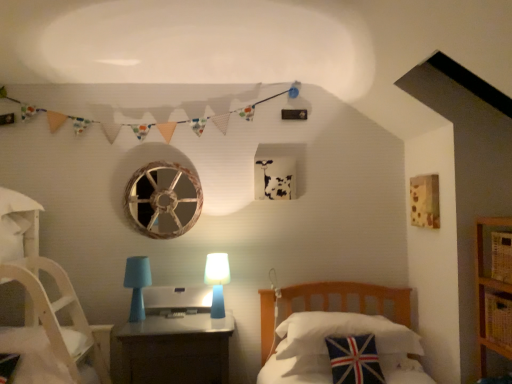
The height and width of the screenshot is (384, 512). I want to click on rustic wood wheel at center, so click(163, 200).

This screenshot has height=384, width=512. What do you see at coordinates (163, 200) in the screenshot?
I see `rustic wood wheel at center` at bounding box center [163, 200].

Locate an element on the screen. The height and width of the screenshot is (384, 512). satin silver desktop at center is located at coordinates (177, 299).

At what (x,y) coordinates should I click in order to perform the action: click on yellow woven basket at lower right. Please return your answer as a coordinate pair (x, y). The image size is (512, 384). Looking at the image, I should click on (498, 317).

Does light blue plastic table lamp at center, the 2th table lamp viewed from the right, have a lesser height compared to matte plastic nightstand at center?

Correct, light blue plastic table lamp at center, the 2th table lamp viewed from the right, is not as tall as matte plastic nightstand at center.

The width and height of the screenshot is (512, 384). I want to click on nightstand below the light blue plastic table lamp at center, the 2th table lamp viewed from the right (from the image's perspective), so point(174,350).

Considering the relative positions of light blue plastic table lamp at center, the 2th table lamp viewed from the right, and matte plastic nightstand at center in the image provided, is light blue plastic table lamp at center, the 2th table lamp viewed from the right, to the left of matte plastic nightstand at center from the viewer's perspective?

Indeed, light blue plastic table lamp at center, the 2th table lamp viewed from the right, is positioned on the left side of matte plastic nightstand at center.

Does point (190, 219) come farther from viewer compared to point (219, 268)?

Yes, it is.

From the picture: Considering the relative sizes of rustic wood wheel at center and blue matte table lamp at center, positioned as the 1th table lamp in right-to-left order, in the image provided, is rustic wood wheel at center taller than blue matte table lamp at center, positioned as the 1th table lamp in right-to-left order,?

Correct, rustic wood wheel at center is much taller as blue matte table lamp at center, positioned as the 1th table lamp in right-to-left order.

Is rustic wood wheel at center positioned behind blue matte table lamp at center, positioned as the 1th table lamp in right-to-left order?

Yes, rustic wood wheel at center is further from the viewer.

Considering the relative sizes of rustic wood wheel at center and blue matte table lamp at center, which appears as the second table lamp when viewed from the left, in the image provided, is rustic wood wheel at center wider than blue matte table lamp at center, which appears as the second table lamp when viewed from the left,?

No.

Looking at this image, which is closer, (311, 326) or (216, 291)?

Point (311, 326) appears to be closer to the viewer than point (216, 291).

Is union jack fabric pillow at center, which appears as the 1th pillow when viewed from the back, looking in the opposite direction of blue matte table lamp at center, positioned as the 1th table lamp in right-to-left order?

No, blue matte table lamp at center, positioned as the 1th table lamp in right-to-left order, is not at the back of union jack fabric pillow at center, which appears as the 1th pillow when viewed from the back.

Considering the relative positions of union jack fabric pillow at center, which appears as the 1th pillow when viewed from the back, and blue matte table lamp at center, positioned as the 1th table lamp in right-to-left order, in the image provided, is union jack fabric pillow at center, which appears as the 1th pillow when viewed from the back, to the left or to the right of blue matte table lamp at center, positioned as the 1th table lamp in right-to-left order,?

union jack fabric pillow at center, which appears as the 1th pillow when viewed from the back, is positioned on blue matte table lamp at center, positioned as the 1th table lamp in right-to-left order,'s right side.

What's the angular difference between union jack fabric pillow at center, which appears as the 1th pillow when viewed from the back, and blue matte table lamp at center, which appears as the second table lamp when viewed from the left,'s facing directions?

2.11 degrees separate the facing orientations of union jack fabric pillow at center, which appears as the 1th pillow when viewed from the back, and blue matte table lamp at center, which appears as the second table lamp when viewed from the left.

Is union jack fabric pillow at lower right, which is the second pillow from back to front, in front of or behind matte plastic nightstand at center in the image?

union jack fabric pillow at lower right, which is the second pillow from back to front, is in front of matte plastic nightstand at center.

Considering the relative positions of union jack fabric pillow at lower right, which appears as the first pillow when viewed from the front, and matte plastic nightstand at center in the image provided, is union jack fabric pillow at lower right, which appears as the first pillow when viewed from the front, to the left of matte plastic nightstand at center from the viewer's perspective?

No.

Is union jack fabric pillow at lower right, which is the second pillow from back to front, bigger than matte plastic nightstand at center?

No, union jack fabric pillow at lower right, which is the second pillow from back to front, is not bigger than matte plastic nightstand at center.

From the image's perspective, is union jack fabric pillow at lower right, which is the second pillow from back to front, positioned above or below matte plastic nightstand at center?

From the image's perspective, union jack fabric pillow at lower right, which is the second pillow from back to front, appears above matte plastic nightstand at center.

Which is more to the right, union jack fabric pillow at center, which appears as the 1th pillow when viewed from the back, or satin silver desktop at center?

union jack fabric pillow at center, which appears as the 1th pillow when viewed from the back, is more to the right.

What's the angular difference between union jack fabric pillow at center, which appears as the 1th pillow when viewed from the back, and satin silver desktop at center's facing directions?

There is a 2.11-degree angle between the facing directions of union jack fabric pillow at center, which appears as the 1th pillow when viewed from the back, and satin silver desktop at center.

Consider the image. Relative to satin silver desktop at center, is union jack fabric pillow at center, which appears as the 1th pillow when viewed from the back, in front or behind?

In the image, union jack fabric pillow at center, which appears as the 1th pillow when viewed from the back, appears in front of satin silver desktop at center.

From the image's perspective, does union jack fabric pillow at center, which appears as the 1th pillow when viewed from the back, appear higher than satin silver desktop at center?

Actually, union jack fabric pillow at center, which appears as the 1th pillow when viewed from the back, appears below satin silver desktop at center in the image.

How different are the orientations of union jack fabric pillow at lower right, which appears as the first pillow when viewed from the front, and union jack fabric pillow at center, which appears as the 1th pillow when viewed from the back, in degrees?

The angle between the facing direction of union jack fabric pillow at lower right, which appears as the first pillow when viewed from the front, and the facing direction of union jack fabric pillow at center, which appears as the 1th pillow when viewed from the back, is 0.00051 degrees.

Considering the sizes of objects union jack fabric pillow at lower right, which appears as the first pillow when viewed from the front, and union jack fabric pillow at center, which appears as the 1th pillow when viewed from the back, in the image provided, who is shorter, union jack fabric pillow at lower right, which appears as the first pillow when viewed from the front, or union jack fabric pillow at center, which appears as the 1th pillow when viewed from the back,?

union jack fabric pillow at center, which appears as the 1th pillow when viewed from the back.

Is union jack fabric pillow at lower right, which is the second pillow from back to front, wider than union jack fabric pillow at center, which is the 2th pillow from front to back?

No.

Is union jack fabric pillow at lower right, which appears as the first pillow when viewed from the front, positioned in front of union jack fabric pillow at center, which is the 2th pillow from front to back?

Yes, the depth of union jack fabric pillow at lower right, which appears as the first pillow when viewed from the front, is less than that of union jack fabric pillow at center, which is the 2th pillow from front to back.

Considering the relative sizes of blue matte table lamp at center, positioned as the 1th table lamp in right-to-left order, and union jack fabric pillow at lower right, which is the second pillow from back to front, in the image provided, is blue matte table lamp at center, positioned as the 1th table lamp in right-to-left order, shorter than union jack fabric pillow at lower right, which is the second pillow from back to front,?

Indeed, blue matte table lamp at center, positioned as the 1th table lamp in right-to-left order, has a lesser height compared to union jack fabric pillow at lower right, which is the second pillow from back to front.

From a real-world perspective, is blue matte table lamp at center, positioned as the 1th table lamp in right-to-left order, on union jack fabric pillow at lower right, which is the second pillow from back to front?

Yes.

Is blue matte table lamp at center, which appears as the second table lamp when viewed from the left, next to union jack fabric pillow at lower right, which appears as the first pillow when viewed from the front, and touching it?

blue matte table lamp at center, which appears as the second table lamp when viewed from the left, and union jack fabric pillow at lower right, which appears as the first pillow when viewed from the front, are not in contact.

Considering the positions of point (206, 283) and point (348, 343), is point (206, 283) closer or farther from the camera than point (348, 343)?

Point (206, 283).

You are a GUI agent. You are given a task and a screenshot of the screen. Output one action in this format:
    pyautogui.click(x=<x>, y=<y>)
    Task: Click on the nightstand that appears below the light blue plastic table lamp at center, the first table lamp from the left (from the image's perspective)
    
    Given the screenshot: What is the action you would take?
    pyautogui.click(x=174, y=350)

I want to click on oval behind the blue matte table lamp at center, which appears as the second table lamp when viewed from the left, so click(163, 200).

Estimate the real-world distances between objects in this image. Which object is closer to yellow woven basket at lower right, light blue plastic table lamp at center, the 2th table lamp viewed from the right, or satin silver desktop at center?

Based on the image, satin silver desktop at center appears to be nearer to yellow woven basket at lower right.

Looking at the image, which one is located closer to light blue plastic table lamp at center, the 2th table lamp viewed from the right, union jack fabric pillow at center, which appears as the 1th pillow when viewed from the back, or matte plastic nightstand at center?

matte plastic nightstand at center.

From the image, which object appears to be nearer to union jack fabric pillow at lower right, which appears as the first pillow when viewed from the front, yellow woven basket at lower right or union jack fabric pillow at center, which appears as the 1th pillow when viewed from the back?

Among the two, union jack fabric pillow at center, which appears as the 1th pillow when viewed from the back, is located nearer to union jack fabric pillow at lower right, which appears as the first pillow when viewed from the front.

Estimate the real-world distances between objects in this image. Which object is closer to matte plastic nightstand at center, light blue plastic table lamp at center, the 2th table lamp viewed from the right, or rustic wood wheel at center?

light blue plastic table lamp at center, the 2th table lamp viewed from the right, lies closer to matte plastic nightstand at center than the other object.

Based on their spatial positions, is rustic wood wheel at center or light blue plastic table lamp at center, the first table lamp from the left, closer to matte plastic nightstand at center?

Among the two, light blue plastic table lamp at center, the first table lamp from the left, is located nearer to matte plastic nightstand at center.

Which object lies nearer to the anchor point satin silver desktop at center, rustic wood wheel at center or union jack fabric pillow at center, which is the 2th pillow from front to back?

rustic wood wheel at center lies closer to satin silver desktop at center than the other object.

From the image, which object appears to be nearer to yellow woven basket at lower right, satin silver desktop at center or matte plastic nightstand at center?

matte plastic nightstand at center is positioned closer to the anchor yellow woven basket at lower right.

Estimate the real-world distances between objects in this image. Which object is closer to union jack fabric pillow at center, which is the 2th pillow from front to back, light blue plastic table lamp at center, the 2th table lamp viewed from the right, or union jack fabric pillow at lower right, which appears as the first pillow when viewed from the front?

The object closer to union jack fabric pillow at center, which is the 2th pillow from front to back, is union jack fabric pillow at lower right, which appears as the first pillow when viewed from the front.

Where is `table lamp between light blue plastic table lamp at center, the first table lamp from the left, and union jack fabric pillow at lower right, which appears as the first pillow when viewed from the front, in the horizontal direction`? This screenshot has width=512, height=384. table lamp between light blue plastic table lamp at center, the first table lamp from the left, and union jack fabric pillow at lower right, which appears as the first pillow when viewed from the front, in the horizontal direction is located at coordinates (217, 281).

In order to click on pillow between satin silver desktop at center and union jack fabric pillow at lower right, which is the second pillow from back to front in this screenshot , I will do `click(342, 333)`.

Where is `nightstand between rustic wood wheel at center and yellow woven basket at lower right from left to right`? nightstand between rustic wood wheel at center and yellow woven basket at lower right from left to right is located at coordinates (x=174, y=350).

Where is `desktop situated between rustic wood wheel at center and yellow woven basket at lower right from left to right`? Image resolution: width=512 pixels, height=384 pixels. desktop situated between rustic wood wheel at center and yellow woven basket at lower right from left to right is located at coordinates (177, 299).